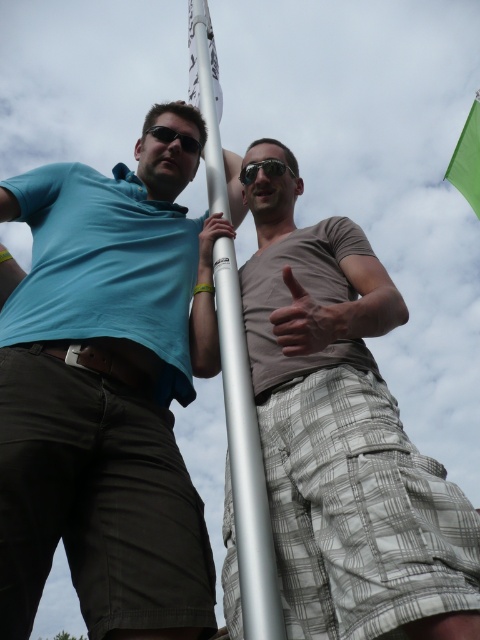
Between point (216, 184) and point (180, 145), which one is positioned behind?

Positioned behind is point (180, 145).

Is silver metallic pole at center bigger than matte black sunglasses at upper center?

Correct, silver metallic pole at center is larger in size than matte black sunglasses at upper center.

This screenshot has width=480, height=640. Describe the element at coordinates (245, 460) in the screenshot. I see `silver metallic pole at center` at that location.

Where is `silver metallic pole at center`? silver metallic pole at center is located at coordinates (245, 460).

Which of these two, silver metallic pole at center or green fabric flag at upper right, stands shorter?

Standing shorter between the two is green fabric flag at upper right.

Who is higher up, silver metallic pole at center or green fabric flag at upper right?

Positioned higher is green fabric flag at upper right.

Describe the element at coordinates (245, 460) in the screenshot. The height and width of the screenshot is (640, 480). I see `silver metallic pole at center` at that location.

Where is `silver metallic pole at center`? This screenshot has width=480, height=640. silver metallic pole at center is located at coordinates click(245, 460).

Can you confirm if green fabric flag at upper right is shorter than black reflective sunglasses at center?

In fact, green fabric flag at upper right may be taller than black reflective sunglasses at center.

Who is more forward, (475, 124) or (282, 168)?

Point (282, 168) is in front.

Find the location of a particular element. green fabric flag at upper right is located at coordinates (468, 157).